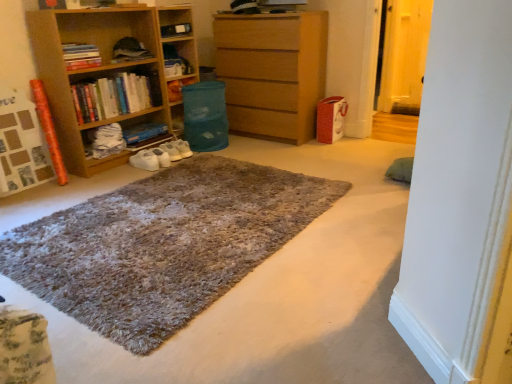
You are a GUI agent. You are given a task and a screenshot of the screen. Output one action in this format:
    pyautogui.click(x=<x>, y=<y>)
    Task: Click on the free spot below shaggy carpet at center (from a real-world perspective)
    The height and width of the screenshot is (384, 512).
    Given the screenshot: What is the action you would take?
    pyautogui.click(x=212, y=212)